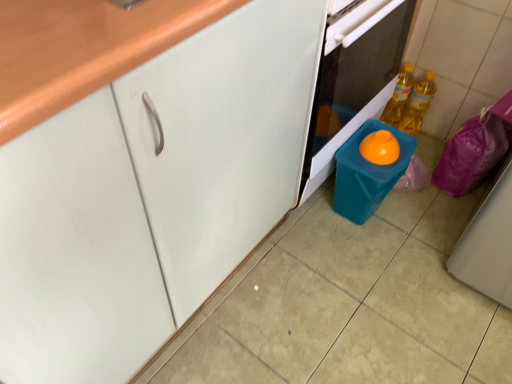
Question: Does blue plastic bin at lower center have a smaller size compared to translucent yellow bottle at right, marked as the second bottle in a left-to-right arrangement?

Choices:
 (A) yes
 (B) no

Answer: (B)

Question: From the image's perspective, is blue plastic bin at lower center located above translucent yellow bottle at right, marked as the second bottle in a left-to-right arrangement?

Choices:
 (A) no
 (B) yes

Answer: (A)

Question: Can you see blue plastic bin at lower center touching translucent yellow bottle at right, arranged as the 1th bottle when viewed from the right?

Choices:
 (A) no
 (B) yes

Answer: (A)

Question: From a real-world perspective, is blue plastic bin at lower center over translucent yellow bottle at right, marked as the second bottle in a left-to-right arrangement?

Choices:
 (A) no
 (B) yes

Answer: (B)

Question: Is translucent yellow bottle at right, arranged as the 1th bottle when viewed from the right, at the back of blue plastic bin at lower center?

Choices:
 (A) no
 (B) yes

Answer: (A)

Question: From the image's perspective, is blue plastic bin at lower center located beneath translucent yellow bottle at right, marked as the second bottle in a left-to-right arrangement?

Choices:
 (A) no
 (B) yes

Answer: (B)

Question: Is blue plastic bin at lower center bigger than yellow translucent bottle at right, positioned as the second bottle in right-to-left order?

Choices:
 (A) no
 (B) yes

Answer: (B)

Question: Is blue plastic bin at lower center further to camera compared to yellow translucent bottle at right, positioned as the second bottle in right-to-left order?

Choices:
 (A) no
 (B) yes

Answer: (A)

Question: Considering the relative sizes of blue plastic bin at lower center and yellow translucent bottle at right, acting as the first bottle starting from the left, in the image provided, is blue plastic bin at lower center shorter than yellow translucent bottle at right, acting as the first bottle starting from the left,?

Choices:
 (A) yes
 (B) no

Answer: (B)

Question: Can you confirm if blue plastic bin at lower center is smaller than yellow translucent bottle at right, positioned as the second bottle in right-to-left order?

Choices:
 (A) no
 (B) yes

Answer: (A)

Question: Can we say blue plastic bin at lower center lies outside yellow translucent bottle at right, acting as the first bottle starting from the left?

Choices:
 (A) no
 (B) yes

Answer: (B)

Question: Is blue plastic bin at lower center in contact with yellow translucent bottle at right, positioned as the second bottle in right-to-left order?

Choices:
 (A) no
 (B) yes

Answer: (A)

Question: Is blue plastic bin at lower center not within teal plastic container at lower right?

Choices:
 (A) no
 (B) yes

Answer: (B)